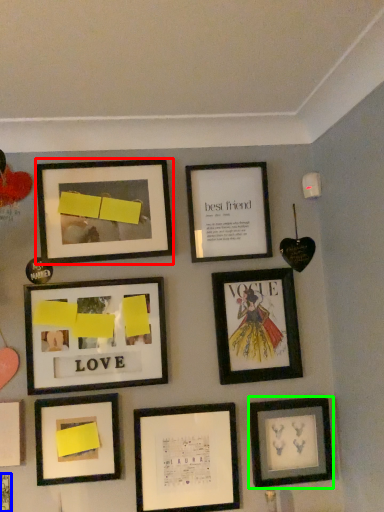
Question: Estimate the real-world distances between objects in this image. Which object is farther from picture frame (highlighted by a red box), picture frame (highlighted by a blue box) or picture frame (highlighted by a green box)?

Choices:
 (A) picture frame
 (B) picture frame

Answer: (A)